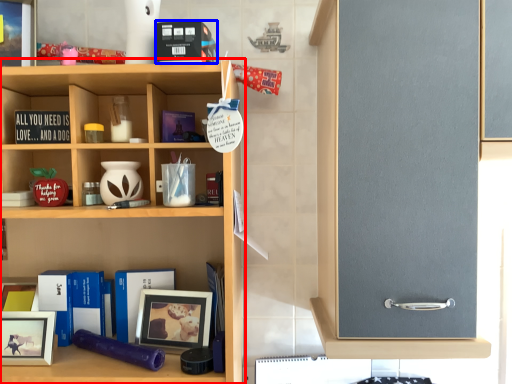
Question: Which point is further to the camera, shelf (highlighted by a red box) or book (highlighted by a blue box)?

Choices:
 (A) shelf
 (B) book

Answer: (A)